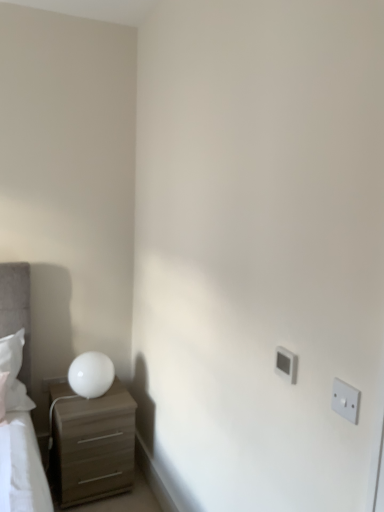
What is the approximate width of white plastic electric outlet at upper right, the 2th electric outlet in the front-to-back sequence?

white plastic electric outlet at upper right, the 2th electric outlet in the front-to-back sequence, is 1.35 inches wide.

Image resolution: width=384 pixels, height=512 pixels. Describe the element at coordinates (286, 364) in the screenshot. I see `white plastic electric outlet at upper right, the first electric outlet viewed from the left` at that location.

Measure the distance between point [73,412] and camera.

The distance of point [73,412] from camera is 7.19 feet.

This screenshot has height=512, width=384. What do you see at coordinates (345, 400) in the screenshot? I see `white plastic electric outlet at right, the first electric outlet when ordered from front to back` at bounding box center [345, 400].

This screenshot has width=384, height=512. I want to click on white glossy table lamp at left, so click(91, 374).

Considering the sizes of objects matte brown chest of drawers at lower left and white glossy table lamp at left in the image provided, who is thinner, matte brown chest of drawers at lower left or white glossy table lamp at left?

white glossy table lamp at left is thinner.

Between matte brown chest of drawers at lower left and white glossy table lamp at left, which one has more height?

With more height is matte brown chest of drawers at lower left.

In the scene shown: Which object is further away from the camera taking this photo, matte brown chest of drawers at lower left or white glossy table lamp at left?

white glossy table lamp at left is further from the camera.

Considering the positions of points (124, 426) and (84, 381), is point (124, 426) farther from camera compared to point (84, 381)?

Yes, it is.

What's the angular difference between white plastic electric outlet at upper right, the second electric outlet positioned from the right, and white glossy table lamp at left's facing directions?

white plastic electric outlet at upper right, the second electric outlet positioned from the right, and white glossy table lamp at left are facing 91.5 degrees away from each other.

Does point (284, 360) lie in front of point (90, 377)?

Yes, point (284, 360) is closer to viewer.

From the image's perspective, is white plastic electric outlet at upper right, the 2th electric outlet in the front-to-back sequence, positioned above or below white glossy table lamp at left?

white plastic electric outlet at upper right, the 2th electric outlet in the front-to-back sequence, is situated higher than white glossy table lamp at left in the image.

From the picture: Can you confirm if white plastic electric outlet at right, arranged as the second electric outlet when viewed from the left, is smaller than matte brown chest of drawers at lower left?

Yes.

Does white plastic electric outlet at right, acting as the 2th electric outlet starting from the back, contain matte brown chest of drawers at lower left?

Actually, matte brown chest of drawers at lower left is outside white plastic electric outlet at right, acting as the 2th electric outlet starting from the back.

From a real-world perspective, is white plastic electric outlet at right, arranged as the second electric outlet when viewed from the left, below matte brown chest of drawers at lower left?

Actually, white plastic electric outlet at right, arranged as the second electric outlet when viewed from the left, is physically above matte brown chest of drawers at lower left in the real world.

From a real-world perspective, which object rests below the other?

white plastic electric outlet at upper right, the 2th electric outlet in the front-to-back sequence, from a real-world perspective.

Is white plastic electric outlet at upper right, the first electric outlet viewed from the left, to the left of white plastic electric outlet at right, arranged as the second electric outlet when viewed from the left, from the viewer's perspective?

Indeed, white plastic electric outlet at upper right, the first electric outlet viewed from the left, is positioned on the left side of white plastic electric outlet at right, arranged as the second electric outlet when viewed from the left.

From the image's perspective, would you say white plastic electric outlet at upper right, marked as the 1th electric outlet in a back-to-front arrangement, is positioned over white plastic electric outlet at right, the first electric outlet when ordered from front to back?

Yes, from the image's perspective, white plastic electric outlet at upper right, marked as the 1th electric outlet in a back-to-front arrangement, is on top of white plastic electric outlet at right, the first electric outlet when ordered from front to back.

How many degrees apart are the facing directions of white plastic electric outlet at upper right, the 2th electric outlet in the front-to-back sequence, and white plastic electric outlet at right, the first electric outlet when ordered from front to back?

The facing directions of white plastic electric outlet at upper right, the 2th electric outlet in the front-to-back sequence, and white plastic electric outlet at right, the first electric outlet when ordered from front to back, are 0.0119 degrees apart.

Can you confirm if white plastic electric outlet at right, arranged as the second electric outlet when viewed from the left, is shorter than white plastic electric outlet at upper right, the 2th electric outlet in the front-to-back sequence?

Incorrect, the height of white plastic electric outlet at right, arranged as the second electric outlet when viewed from the left, does not fall short of that of white plastic electric outlet at upper right, the 2th electric outlet in the front-to-back sequence.

Which is more to the right, white plastic electric outlet at right, arranged as the second electric outlet when viewed from the left, or white plastic electric outlet at upper right, the first electric outlet viewed from the left?

Positioned to the right is white plastic electric outlet at right, arranged as the second electric outlet when viewed from the left.

Is the position of white plastic electric outlet at right, arranged as the second electric outlet when viewed from the left, more distant than that of white plastic electric outlet at upper right, the first electric outlet viewed from the left?

No, white plastic electric outlet at right, arranged as the second electric outlet when viewed from the left, is closer to the camera.

Is white plastic electric outlet at upper right, the 2th electric outlet in the front-to-back sequence, located within white glossy table lamp at left?

No, white plastic electric outlet at upper right, the 2th electric outlet in the front-to-back sequence, is not surrounded by white glossy table lamp at left.

In the scene shown: Which of these two, white glossy table lamp at left or white plastic electric outlet at upper right, the first electric outlet viewed from the left, is bigger?

white glossy table lamp at left is bigger.

In the scene shown: From a real-world perspective, is matte brown chest of drawers at lower left physically above white plastic electric outlet at upper right, the first electric outlet viewed from the left?

No, from a real-world perspective, matte brown chest of drawers at lower left is not on top of white plastic electric outlet at upper right, the first electric outlet viewed from the left.

How many degrees apart are the facing directions of matte brown chest of drawers at lower left and white plastic electric outlet at upper right, the second electric outlet positioned from the right?

matte brown chest of drawers at lower left and white plastic electric outlet at upper right, the second electric outlet positioned from the right, are facing 91.5 degrees away from each other.

Would you say matte brown chest of drawers at lower left is outside white plastic electric outlet at upper right, the second electric outlet positioned from the right?

Yes, matte brown chest of drawers at lower left is located beyond the bounds of white plastic electric outlet at upper right, the second electric outlet positioned from the right.

From the image's perspective, is matte brown chest of drawers at lower left above white plastic electric outlet at upper right, the first electric outlet viewed from the left?

Actually, matte brown chest of drawers at lower left appears below white plastic electric outlet at upper right, the first electric outlet viewed from the left, in the image.

Locate an element on the screen. The height and width of the screenshot is (512, 384). chest of drawers below the white glossy table lamp at left (from a real-world perspective) is located at coordinates (91, 444).

At what (x,y) coordinates should I click in order to perform the action: click on electric outlet that is the 1st object to the right of the white glossy table lamp at left, starting at the anchor. Please return your answer as a coordinate pair (x, y). The image size is (384, 512). Looking at the image, I should click on (286, 364).

Based on their spatial positions, is matte brown chest of drawers at lower left or white plastic electric outlet at upper right, the first electric outlet viewed from the left, further from white plastic electric outlet at right, arranged as the second electric outlet when viewed from the left?

matte brown chest of drawers at lower left lies further to white plastic electric outlet at right, arranged as the second electric outlet when viewed from the left, than the other object.

Looking at the image, which one is located further to white plastic electric outlet at upper right, marked as the 1th electric outlet in a back-to-front arrangement, matte brown chest of drawers at lower left or white plastic electric outlet at right, the 1th electric outlet when ordered from right to left?

matte brown chest of drawers at lower left lies further to white plastic electric outlet at upper right, marked as the 1th electric outlet in a back-to-front arrangement, than the other object.

Considering their positions, is white plastic electric outlet at upper right, the 2th electric outlet in the front-to-back sequence, positioned further to white glossy table lamp at left than white plastic electric outlet at right, acting as the 2th electric outlet starting from the back?

white plastic electric outlet at right, acting as the 2th electric outlet starting from the back, is further to white glossy table lamp at left.

Estimate the real-world distances between objects in this image. Which object is closer to matte brown chest of drawers at lower left, white plastic electric outlet at upper right, marked as the 1th electric outlet in a back-to-front arrangement, or white glossy table lamp at left?

Among the two, white glossy table lamp at left is located nearer to matte brown chest of drawers at lower left.

From the picture: Estimate the real-world distances between objects in this image. Which object is further from white plastic electric outlet at right, the first electric outlet when ordered from front to back, matte brown chest of drawers at lower left or white glossy table lamp at left?

Based on the image, matte brown chest of drawers at lower left appears to be further to white plastic electric outlet at right, the first electric outlet when ordered from front to back.

Estimate the real-world distances between objects in this image. Which object is further from white glossy table lamp at left, white plastic electric outlet at right, the 1th electric outlet when ordered from right to left, or white plastic electric outlet at upper right, marked as the 1th electric outlet in a back-to-front arrangement?

white plastic electric outlet at right, the 1th electric outlet when ordered from right to left, is further to white glossy table lamp at left.

Considering their positions, is white glossy table lamp at left positioned further to matte brown chest of drawers at lower left than white plastic electric outlet at upper right, marked as the 1th electric outlet in a back-to-front arrangement?

white plastic electric outlet at upper right, marked as the 1th electric outlet in a back-to-front arrangement, is further to matte brown chest of drawers at lower left.

Estimate the real-world distances between objects in this image. Which object is further from white plastic electric outlet at upper right, the 2th electric outlet in the front-to-back sequence, matte brown chest of drawers at lower left or white glossy table lamp at left?

matte brown chest of drawers at lower left.

This screenshot has width=384, height=512. In order to click on the chest of drawers located between white plastic electric outlet at upper right, the second electric outlet positioned from the right, and white glossy table lamp at left in the depth direction in this screenshot , I will do `click(91, 444)`.

Find the location of a particular element. Image resolution: width=384 pixels, height=512 pixels. electric outlet located between white plastic electric outlet at right, acting as the 2th electric outlet starting from the back, and matte brown chest of drawers at lower left in the depth direction is located at coordinates (286, 364).

I want to click on chest of drawers between white plastic electric outlet at right, arranged as the second electric outlet when viewed from the left, and white glossy table lamp at left in the front-back direction, so click(x=91, y=444).

Identify the location of electric outlet between white plastic electric outlet at right, the first electric outlet when ordered from front to back, and white glossy table lamp at left, along the z-axis. (286, 364).